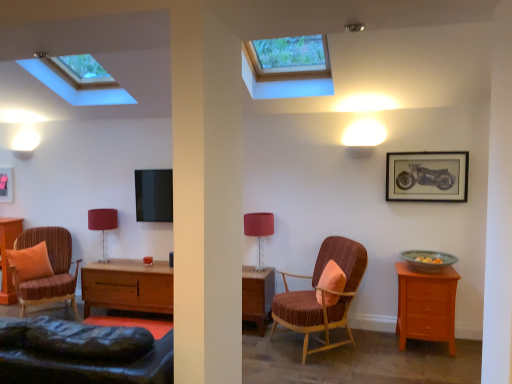
Question: Can you confirm if matte black picture frame at upper right, which is the 1th picture frame from right to left, is thinner than matte pink fabric at center, which ranks as the first table lamp in right-to-left order?

Choices:
 (A) yes
 (B) no

Answer: (A)

Question: Is matte black picture frame at upper right, which is the 1th picture frame from right to left, smaller than matte pink fabric at center, positioned as the first table lamp in front-to-back order?

Choices:
 (A) yes
 (B) no

Answer: (A)

Question: Considering the relative positions of matte black picture frame at upper right, marked as the second picture frame in a left-to-right arrangement, and matte pink fabric at center, the second table lamp positioned from the left, in the image provided, is matte black picture frame at upper right, marked as the second picture frame in a left-to-right arrangement, in front of matte pink fabric at center, the second table lamp positioned from the left,?

Choices:
 (A) yes
 (B) no

Answer: (A)

Question: Considering the relative sizes of matte black picture frame at upper right, positioned as the first picture frame in front-to-back order, and matte pink fabric at center, which ranks as the first table lamp in right-to-left order, in the image provided, is matte black picture frame at upper right, positioned as the first picture frame in front-to-back order, shorter than matte pink fabric at center, which ranks as the first table lamp in right-to-left order,?

Choices:
 (A) no
 (B) yes

Answer: (B)

Question: Is matte black picture frame at upper right, which is the 1th picture frame from right to left, beside matte pink fabric at center, the second table lamp positioned from the left?

Choices:
 (A) yes
 (B) no

Answer: (B)

Question: From the image's perspective, is matte black picture frame at upper left, acting as the second picture frame starting from the front, positioned above or below matte brown armchair at left, which is counted as the second chair, starting from the right?

Choices:
 (A) above
 (B) below

Answer: (A)

Question: In terms of size, does matte black picture frame at upper left, which appears as the first picture frame when viewed from the back, appear bigger or smaller than matte brown armchair at left, the 1th chair in the left-to-right sequence?

Choices:
 (A) big
 (B) small

Answer: (B)

Question: Choose the correct answer: Is matte black picture frame at upper left, which appears as the first picture frame when viewed from the back, inside matte brown armchair at left, which is counted as the second chair, starting from the right, or outside it?

Choices:
 (A) outside
 (B) inside

Answer: (A)

Question: In the image, is matte black picture frame at upper left, the first picture frame from the left, positioned in front of or behind matte brown armchair at left, the 1th chair in the left-to-right sequence?

Choices:
 (A) front
 (B) behind

Answer: (B)

Question: In terms of size, does matte red lampshade at center, positioned as the 1th table lamp in left-to-right order, appear bigger or smaller than matte black picture frame at upper left, which is counted as the second picture frame, starting from the right?

Choices:
 (A) small
 (B) big

Answer: (B)

Question: From a real-world perspective, is matte red lampshade at center, which is the first table lamp in back-to-front order, above or below matte black picture frame at upper left, acting as the second picture frame starting from the front?

Choices:
 (A) above
 (B) below

Answer: (B)

Question: From their relative heights in the image, would you say matte red lampshade at center, positioned as the 1th table lamp in left-to-right order, is taller or shorter than matte black picture frame at upper left, the first picture frame from the left?

Choices:
 (A) short
 (B) tall

Answer: (B)

Question: Relative to matte black picture frame at upper left, which appears as the first picture frame when viewed from the back, is matte red lampshade at center, which is the second table lamp from right to left, in front or behind?

Choices:
 (A) front
 (B) behind

Answer: (A)

Question: Is velvet-like brown armchair at center, which appears as the first chair when viewed from the right, situated inside matte black picture frame at upper right, which is the 1th picture frame from right to left, or outside?

Choices:
 (A) inside
 (B) outside

Answer: (B)

Question: Is velvet-like brown armchair at center, the second chair in the left-to-right sequence, in front of or behind matte black picture frame at upper right, positioned as the first picture frame in front-to-back order, in the image?

Choices:
 (A) behind
 (B) front

Answer: (B)